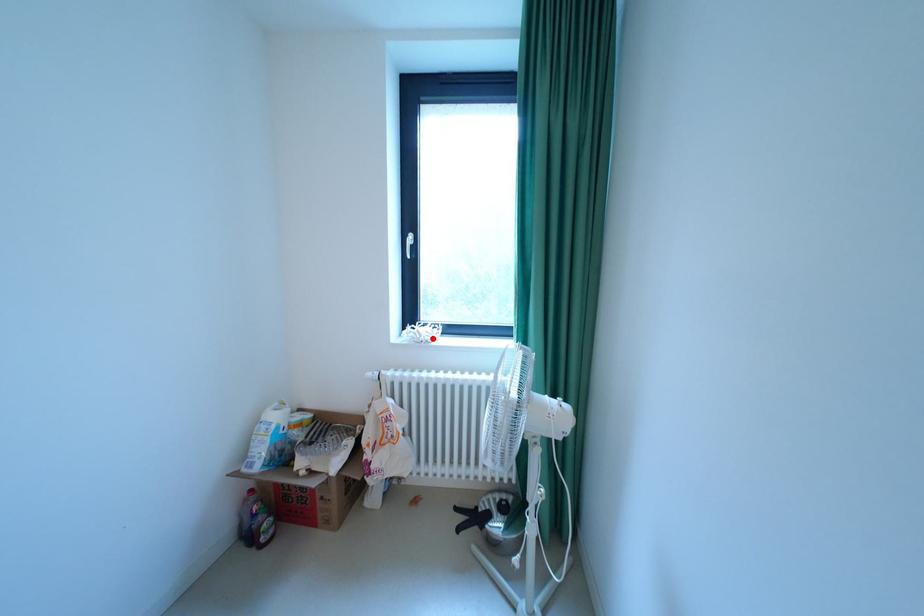
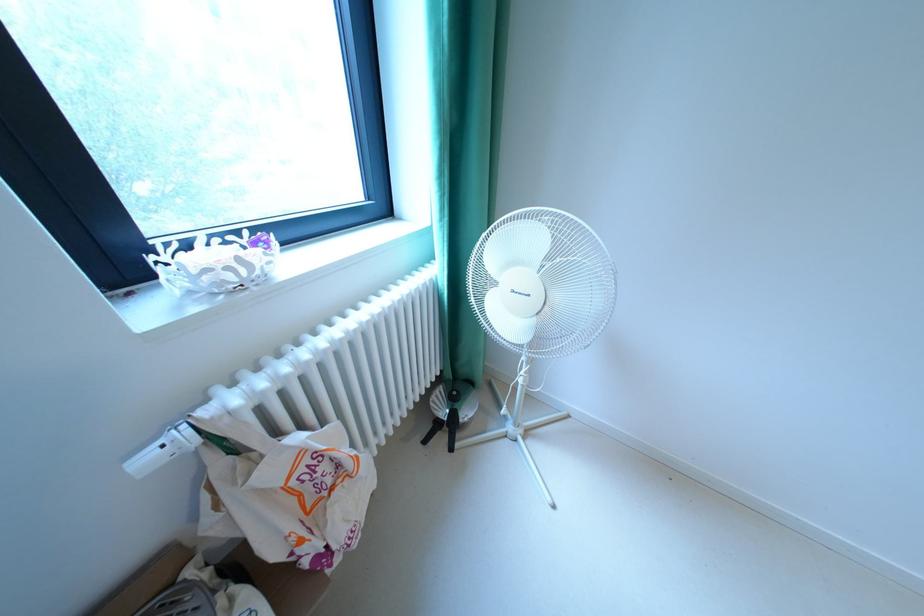
Locate, in the second image, the point that corresponds to the highlighted location in the first image.

(268, 273)